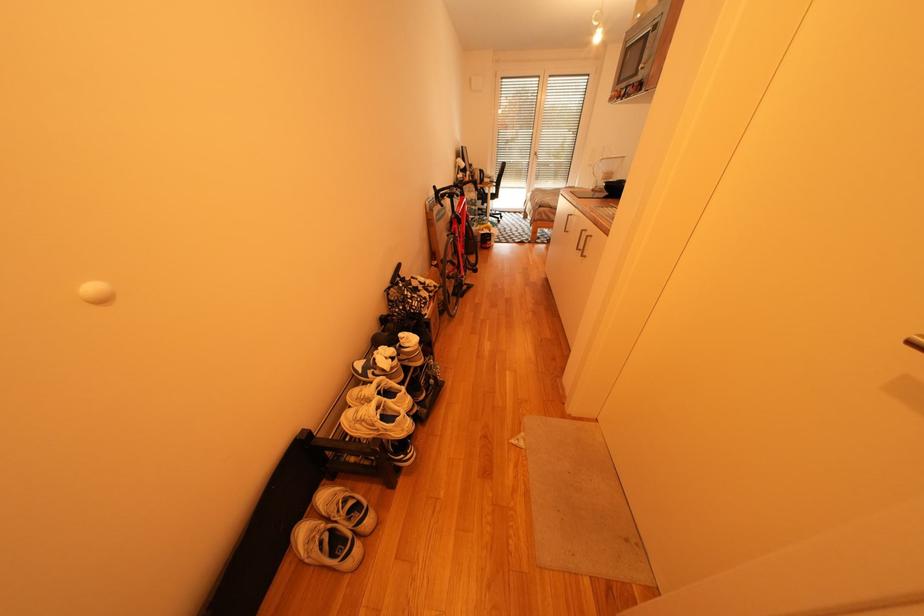
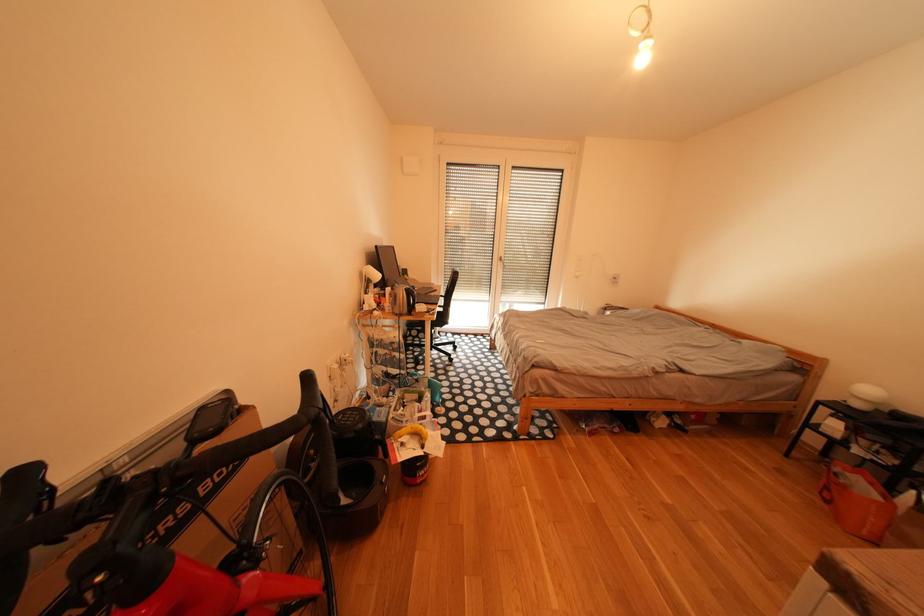
Question: What movement of the cameraman would produce the second image?

Choices:
 (A) Left
 (B) Right
 (C) Forward
 (D) Backward

Answer: (C)